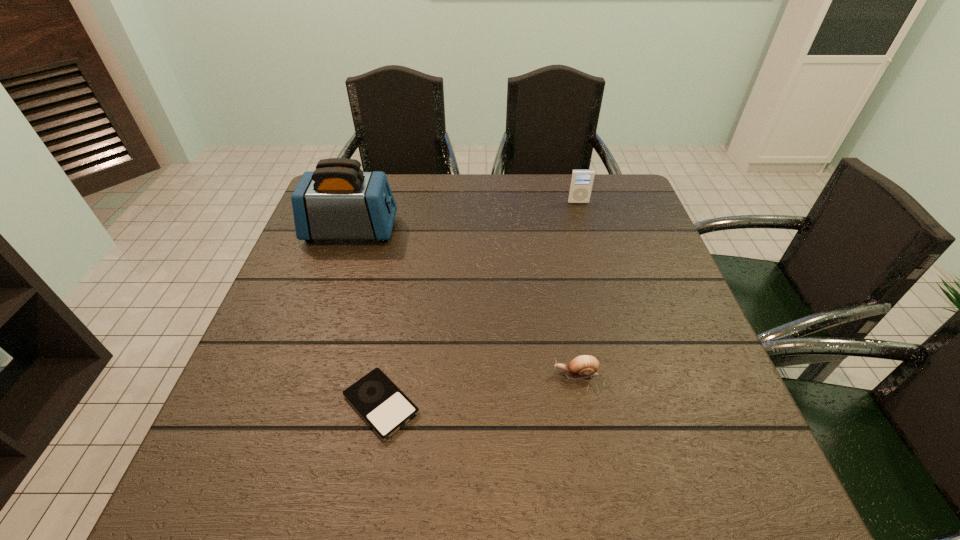
Image resolution: width=960 pixels, height=540 pixels. In order to click on vacant area at the far edge of the desktop in this screenshot , I will do `click(402, 210)`.

Locate an element on the screen. free space at the left edge of the desktop is located at coordinates (308, 267).

I want to click on free space at the right edge of the desktop, so click(x=664, y=349).

You are a GUI agent. You are given a task and a screenshot of the screen. Output one action in this format:
    pyautogui.click(x=<x>, y=<y>)
    Task: Click on the free region at the far right corner of the desktop
    This screenshot has height=540, width=960.
    Given the screenshot: What is the action you would take?
    pyautogui.click(x=604, y=203)

This screenshot has width=960, height=540. What are the coordinates of `vacant space at the near right corner of the desktop` in the screenshot? It's located at (x=732, y=485).

Where is `free space between the toaster and the second shortest object`? This screenshot has height=540, width=960. free space between the toaster and the second shortest object is located at coordinates (464, 302).

In order to click on free space between the second object from right to left and the taller iPod in this screenshot , I will do `click(577, 288)`.

Identify the location of free point between the left iPod and the third object from left to right. This screenshot has width=960, height=540. (478, 389).

Where is `free space between the shortest object and the second shortest object`? Image resolution: width=960 pixels, height=540 pixels. free space between the shortest object and the second shortest object is located at coordinates (478, 389).

The width and height of the screenshot is (960, 540). In order to click on free point between the shortest object and the escargot in this screenshot , I will do `click(478, 389)`.